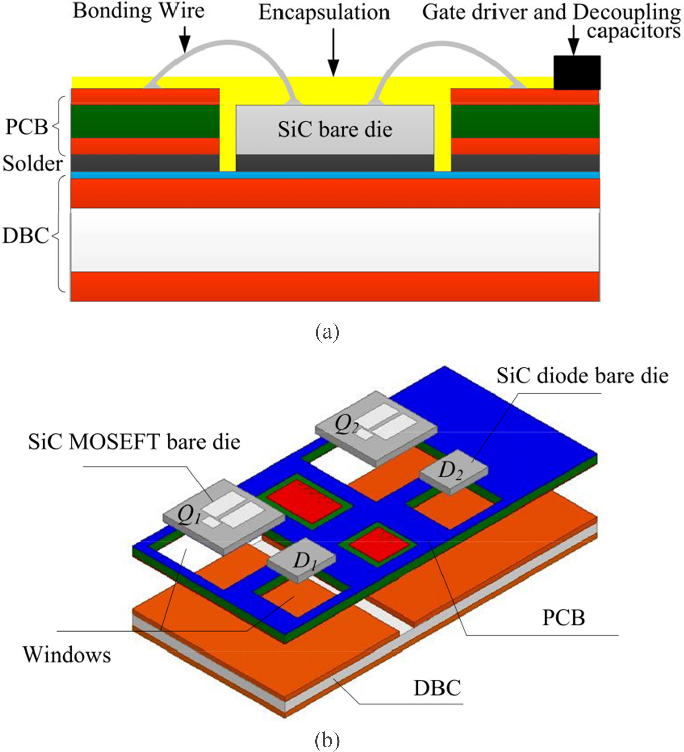
Locate an element on the screen. green panel is located at coordinates (445, 543).